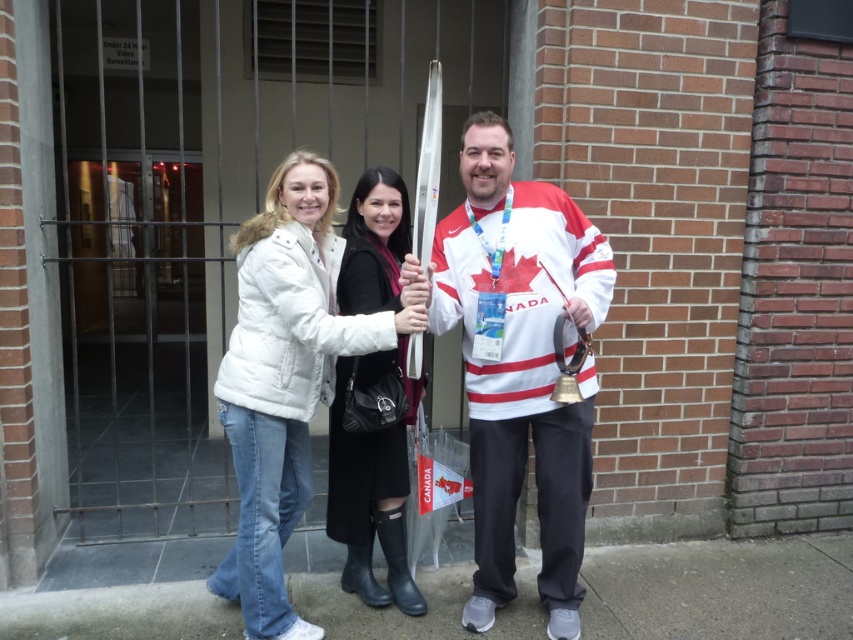
Measure the distance between white matte jacket at center and camera.

The distance of white matte jacket at center from camera is 8.01 feet.

Who is positioned more to the right, white matte jacket at center or white fleece jacket at center?

From the viewer's perspective, white matte jacket at center appears more on the right side.

Is point (572, 604) positioned before point (262, 244)?

No, it is not.

Find the location of a particular element. white matte jacket at center is located at coordinates (520, 364).

Is white fleece jacket at center in front of black leather boots at center?

Yes, it is.

You are a GUI agent. You are given a task and a screenshot of the screen. Output one action in this format:
    pyautogui.click(x=<x>, y=<y>)
    Task: Click on the white fleece jacket at center
    This screenshot has width=853, height=640.
    Given the screenshot: What is the action you would take?
    pyautogui.click(x=285, y=378)

Does white jersey at center have a larger size compared to white fleece jacket at center?

Indeed, white jersey at center has a larger size compared to white fleece jacket at center.

Who is shorter, white jersey at center or white fleece jacket at center?

Result: With less height is white fleece jacket at center.

Is point (500, 243) positioned after point (349, 337)?

Yes, it is behind point (349, 337).

What are the coordinates of `white jersey at center` in the screenshot? It's located at (520, 364).